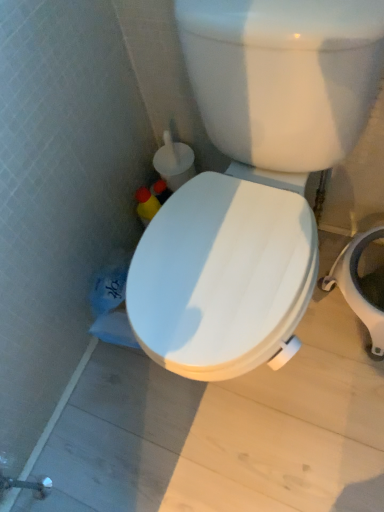
In order to click on vacant area that is in front of white glossy toilet seat at center in this screenshot , I will do `click(283, 433)`.